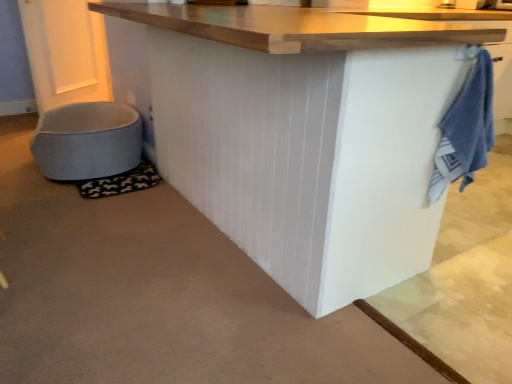
The height and width of the screenshot is (384, 512). What do you see at coordinates (87, 141) in the screenshot?
I see `light blue fabric pet bed at lower left` at bounding box center [87, 141].

Describe the element at coordinates (465, 131) in the screenshot. The image size is (512, 384). I see `blue terry cloth towel at right` at that location.

Looking at this image, measure the distance between point [379,95] and camera.

The depth of point [379,95] is 3.88 feet.

Locate an element on the screen. This screenshot has width=512, height=384. light blue fabric pet bed at lower left is located at coordinates (87, 141).

Is light blue fabric pet bed at lower left at the right side of white matte table at center?

In fact, light blue fabric pet bed at lower left is to the left of white matte table at center.

Considering the relative sizes of light blue fabric pet bed at lower left and white matte table at center in the image provided, is light blue fabric pet bed at lower left taller than white matte table at center?

No, light blue fabric pet bed at lower left is not taller than white matte table at center.

Between light blue fabric pet bed at lower left and white matte table at center, which one is positioned behind?

light blue fabric pet bed at lower left is further from the camera.

Who is bigger, light blue fabric pet bed at lower left or blue terry cloth towel at right?

light blue fabric pet bed at lower left.

From a real-world perspective, between light blue fabric pet bed at lower left and blue terry cloth towel at right, who is vertically lower?

From a 3D spatial view, light blue fabric pet bed at lower left is below.

Does light blue fabric pet bed at lower left have a greater width compared to blue terry cloth towel at right?

Correct, the width of light blue fabric pet bed at lower left exceeds that of blue terry cloth towel at right.

Considering the positions of objects blue terry cloth towel at right and white matte table at center in the image provided, who is more to the left, blue terry cloth towel at right or white matte table at center?

blue terry cloth towel at right is more to the left.

Can you confirm if blue terry cloth towel at right is thinner than white matte table at center?

Correct, the width of blue terry cloth towel at right is less than that of white matte table at center.

From a real-world perspective, which is physically above, blue terry cloth towel at right or white matte table at center?

blue terry cloth towel at right, from a real-world perspective.

I want to click on table above the light blue fabric pet bed at lower left (from a real-world perspective), so click(305, 135).

Is point (346, 175) positioned before point (70, 179)?

Yes.

Between white matte table at center and light blue fabric pet bed at lower left, which one has less height?

With less height is light blue fabric pet bed at lower left.

From a real-world perspective, is white matte table at center physically located above or below light blue fabric pet bed at lower left?

Clearly, from a real-world perspective, white matte table at center is above light blue fabric pet bed at lower left.

Which is in front, point (437, 177) or point (109, 131)?

The point (437, 177) is closer to the camera.

How many degrees apart are the facing directions of blue terry cloth towel at right and light blue fabric pet bed at lower left?

5.36 degrees.

From the picture: In the image, is blue terry cloth towel at right positioned in front of or behind light blue fabric pet bed at lower left?

blue terry cloth towel at right is positioned closer to the viewer than light blue fabric pet bed at lower left.

Does white matte table at center lie in front of blue terry cloth towel at right?

That is True.

From the image's perspective, is white matte table at center located above or below blue terry cloth towel at right?

Based on their image positions, white matte table at center is located above blue terry cloth towel at right.

Do you think white matte table at center is within blue terry cloth towel at right, or outside of it?

white matte table at center exists outside the volume of blue terry cloth towel at right.

The width and height of the screenshot is (512, 384). I want to click on toilet bowl behind the white matte table at center, so click(87, 141).

Image resolution: width=512 pixels, height=384 pixels. In the image, there is a light blue fabric pet bed at lower left. What are the coordinates of `bath towel below it (from the image's perspective)` in the screenshot? It's located at (465, 131).

Looking at the image, which one is located closer to white matte table at center, blue terry cloth towel at right or light blue fabric pet bed at lower left?

blue terry cloth towel at right is positioned closer to the anchor white matte table at center.

Based on the photo, considering their positions, is light blue fabric pet bed at lower left positioned further to blue terry cloth towel at right than white matte table at center?

light blue fabric pet bed at lower left.

Considering their positions, is blue terry cloth towel at right positioned further to light blue fabric pet bed at lower left than white matte table at center?

blue terry cloth towel at right is positioned further to the anchor light blue fabric pet bed at lower left.

Based on their spatial positions, is white matte table at center or light blue fabric pet bed at lower left further from blue terry cloth towel at right?

light blue fabric pet bed at lower left is further to blue terry cloth towel at right.

From the picture: From the image, which object appears to be farther from white matte table at center, light blue fabric pet bed at lower left or blue terry cloth towel at right?

The object further to white matte table at center is light blue fabric pet bed at lower left.

Based on their spatial positions, is white matte table at center or blue terry cloth towel at right further from light blue fabric pet bed at lower left?

Among the two, blue terry cloth towel at right is located further to light blue fabric pet bed at lower left.

You are a GUI agent. You are given a task and a screenshot of the screen. Output one action in this format:
    pyautogui.click(x=<x>, y=<y>)
    Task: Click on the bath towel situated between light blue fabric pet bed at lower left and white matte table at center from left to right
    This screenshot has width=512, height=384.
    Given the screenshot: What is the action you would take?
    pyautogui.click(x=465, y=131)